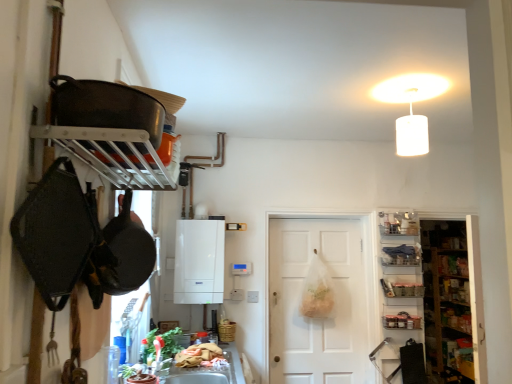
The width and height of the screenshot is (512, 384). I want to click on wooden basket at lower center, so click(227, 331).

The width and height of the screenshot is (512, 384). What do you see at coordinates (318, 318) in the screenshot?
I see `white matte door at center` at bounding box center [318, 318].

The height and width of the screenshot is (384, 512). Describe the element at coordinates (199, 262) in the screenshot. I see `white matte boiler at center` at that location.

Measure the distance between point (393, 292) and camera.

Point (393, 292) and camera are 3.54 meters apart.

This screenshot has width=512, height=384. What do you see at coordinates (106, 107) in the screenshot?
I see `shiny black frying pan at upper left` at bounding box center [106, 107].

Where is `wooden shelves at right`? wooden shelves at right is located at coordinates (454, 299).

Considering the relative positions of metallic silver shelf at upper right, which is the third shelf in bottom-to-top order, and white matte boiler at center in the image provided, is metallic silver shelf at upper right, which is the third shelf in bottom-to-top order, to the left or to the right of white matte boiler at center?

metallic silver shelf at upper right, which is the third shelf in bottom-to-top order, is to the right of white matte boiler at center.

From the image's perspective, which shelf is the 2nd one above the white matte boiler at center? Please provide its 2D coordinates.

[(398, 224)]

From a real-world perspective, is metallic silver shelf at upper right, which is the third shelf in bottom-to-top order, physically below white matte boiler at center?

Incorrect, from a real-world perspective, metallic silver shelf at upper right, which is the third shelf in bottom-to-top order, is higher than white matte boiler at center.

Consider the image. Is metallic silver shelf at upper right, arranged as the 1th shelf when viewed from the top, facing towards white matte boiler at center?

No.

Considering the relative positions of white matte boiler at center and matte plastic shelf at right, marked as the second shelf in a bottom-to-top arrangement, in the image provided, is white matte boiler at center to the left of matte plastic shelf at right, marked as the second shelf in a bottom-to-top arrangement, from the viewer's perspective?

Correct, you'll find white matte boiler at center to the left of matte plastic shelf at right, marked as the second shelf in a bottom-to-top arrangement.

From a real-world perspective, is white matte boiler at center located higher than matte plastic shelf at right, the 2th shelf viewed from the top?

No.

From the image's perspective, does white matte boiler at center appear lower than matte plastic shelf at right, marked as the second shelf in a bottom-to-top arrangement?

Yes, from the image's perspective, white matte boiler at center is beneath matte plastic shelf at right, marked as the second shelf in a bottom-to-top arrangement.

Consider the image. Can you tell me how much white matte boiler at center and matte plastic shelf at right, marked as the second shelf in a bottom-to-top arrangement, differ in facing direction?

1.84 degrees separate the facing orientations of white matte boiler at center and matte plastic shelf at right, marked as the second shelf in a bottom-to-top arrangement.

Choose the correct answer: Is metallic silver shelf at upper right, arranged as the 1th shelf when viewed from the top, inside white matte door at center or outside it?

metallic silver shelf at upper right, arranged as the 1th shelf when viewed from the top, is spatially situated outside white matte door at center.

Find the location of a particular element. The width and height of the screenshot is (512, 384). the 3rd shelf directly above the white matte door at center (from a real-world perspective) is located at coordinates (398, 224).

Between metallic silver shelf at upper right, which is the third shelf in bottom-to-top order, and white matte door at center, which one has smaller size?

Smaller between the two is metallic silver shelf at upper right, which is the third shelf in bottom-to-top order.

Is metallic silver shelf at upper right, which is the third shelf in bottom-to-top order, facing away from white matte door at center?

That's not correct — metallic silver shelf at upper right, which is the third shelf in bottom-to-top order, is not looking away from white matte door at center.

Does white matte door at center turn towards shiny black frying pan at upper left?

Yes, white matte door at center is aimed at shiny black frying pan at upper left.

From the image's perspective, between white matte door at center and shiny black frying pan at upper left, which one is located above?

shiny black frying pan at upper left, from the image's perspective.

Considering the positions of objects white matte door at center and shiny black frying pan at upper left in the image provided, who is more to the left, white matte door at center or shiny black frying pan at upper left?

Positioned to the left is shiny black frying pan at upper left.

Does white matte door at center have a lesser width compared to shiny black frying pan at upper left?

Correct, the width of white matte door at center is less than that of shiny black frying pan at upper left.

Is wooden basket at lower center behind metallic glass jars at right?

That is False.

Is wooden basket at lower center not near metallic glass jars at right?

Yes, wooden basket at lower center and metallic glass jars at right are located far from each other.

Considering the relative sizes of wooden basket at lower center and metallic glass jars at right in the image provided, is wooden basket at lower center taller than metallic glass jars at right?

No, wooden basket at lower center is not taller than metallic glass jars at right.

Is wooden basket at lower center inside or outside of metallic glass jars at right?

wooden basket at lower center is outside metallic glass jars at right.

Which of these two, wooden basket at lower center or shiny black frying pan at upper left, is bigger?

With larger size is shiny black frying pan at upper left.

Is wooden basket at lower center to the left of shiny black frying pan at upper left from the viewer's perspective?

No.

Is shiny black frying pan at upper left at the back of wooden basket at lower center?

No, wooden basket at lower center's orientation is not away from shiny black frying pan at upper left.

Is wooden basket at lower center in front of or behind shiny black frying pan at upper left in the image?

wooden basket at lower center is behind shiny black frying pan at upper left.

Between wooden basket at lower center and wooden shelves at right, which one is positioned behind?

wooden shelves at right is more distant.

Does wooden basket at lower center appear on the right side of wooden shelves at right?

No, wooden basket at lower center is not to the right of wooden shelves at right.

From the image's perspective, does wooden basket at lower center appear higher than wooden shelves at right?

No, from the image's perspective, wooden basket at lower center is not above wooden shelves at right.

At what (x,y) coordinates should I click in order to perform the action: click on the 1st shelf to the right of the white matte boiler at center, starting your count from the anchor. Please return your answer as a coordinate pair (x, y). Looking at the image, I should click on pos(398,224).

Where is `appliance below the matte plastic shelf at right, the 2th shelf viewed from the top (from the image's perspective)`? Image resolution: width=512 pixels, height=384 pixels. appliance below the matte plastic shelf at right, the 2th shelf viewed from the top (from the image's perspective) is located at coordinates (199, 262).

Which object lies further to the anchor point white matte boiler at center, matte plastic shelf at right, marked as the second shelf in a bottom-to-top arrangement, or wooden shelves at right?

Answer: wooden shelves at right.

Which object lies nearer to the anchor point wooden shelves at right, shiny black frying pan at upper left or matte plastic shelf at right, the 2th shelf viewed from the top?

Among the two, matte plastic shelf at right, the 2th shelf viewed from the top, is located nearer to wooden shelves at right.

From the picture: Based on their spatial positions, is metallic silver tray at right, the third shelf in the top-to-bottom sequence, or wooden basket at lower center further from shiny black frying pan at upper left?

Among the two, metallic silver tray at right, the third shelf in the top-to-bottom sequence, is located further to shiny black frying pan at upper left.

Looking at the image, which one is located further to white matte door at center, metallic glass jars at right or white matte boiler at center?

Based on the image, white matte boiler at center appears to be further to white matte door at center.

From the image, which object appears to be nearer to metallic silver shelf at upper right, which is the third shelf in bottom-to-top order, white matte door at center or wooden basket at lower center?

The object closer to metallic silver shelf at upper right, which is the third shelf in bottom-to-top order, is white matte door at center.

From the image, which object appears to be farther from shiny black frying pan at upper left, wooden basket at lower center or white matte boiler at center?

Based on the image, wooden basket at lower center appears to be further to shiny black frying pan at upper left.

Estimate the real-world distances between objects in this image. Which object is further from white matte door at center, metallic silver shelf at upper right, arranged as the 1th shelf when viewed from the top, or matte plastic shelf at right, the 2th shelf viewed from the top?

metallic silver shelf at upper right, arranged as the 1th shelf when viewed from the top, lies further to white matte door at center than the other object.

Which object lies further to the anchor point wooden shelves at right, white matte door at center or shiny black frying pan at upper left?

Among the two, shiny black frying pan at upper left is located further to wooden shelves at right.

Identify the location of stuff between white matte boiler at center and wooden shelves at right. The width and height of the screenshot is (512, 384). (402, 321).

I want to click on door located between wooden basket at lower center and matte plastic shelf at right, marked as the second shelf in a bottom-to-top arrangement, in the left-right direction, so click(x=318, y=318).

The width and height of the screenshot is (512, 384). I want to click on basket between shiny black frying pan at upper left and metallic silver tray at right, the third shelf in the top-to-bottom sequence, in the front-back direction, so click(227, 331).

You are a GUI agent. You are given a task and a screenshot of the screen. Output one action in this format:
    pyautogui.click(x=<x>, y=<y>)
    Task: Click on the door between white matte boiler at center and metallic glass jars at right
    The height and width of the screenshot is (384, 512).
    Given the screenshot: What is the action you would take?
    pyautogui.click(x=318, y=318)